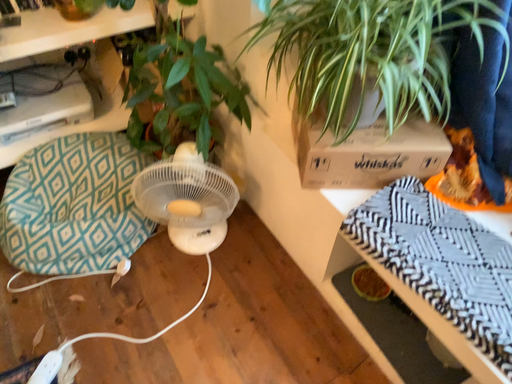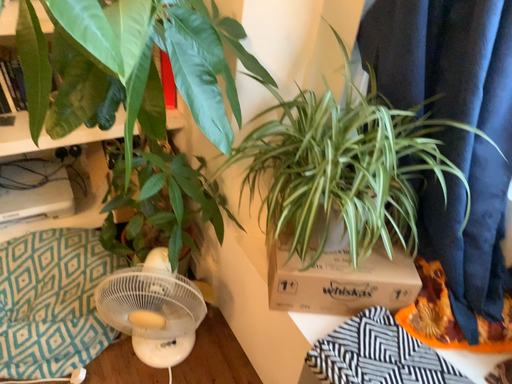
Question: How did the camera likely rotate when shooting the video?

Choices:
 (A) rotated downward
 (B) rotated upward

Answer: (B)